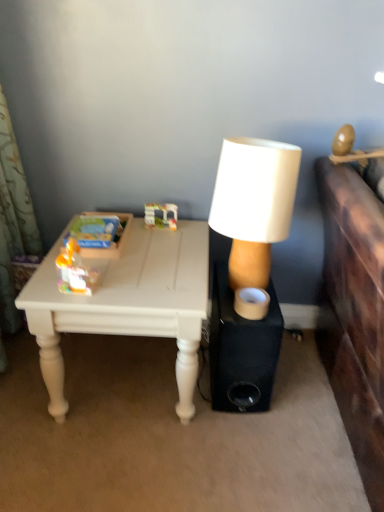
Where is `free space to the right of white painted wood table at lower left`? free space to the right of white painted wood table at lower left is located at coordinates (278, 414).